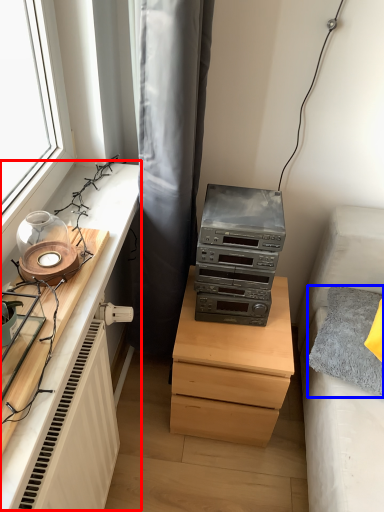
Question: Which object appears farthest to the camera in this image, entertainment center (highlighted by a red box) or pillow (highlighted by a blue box)?

Choices:
 (A) entertainment center
 (B) pillow

Answer: (B)